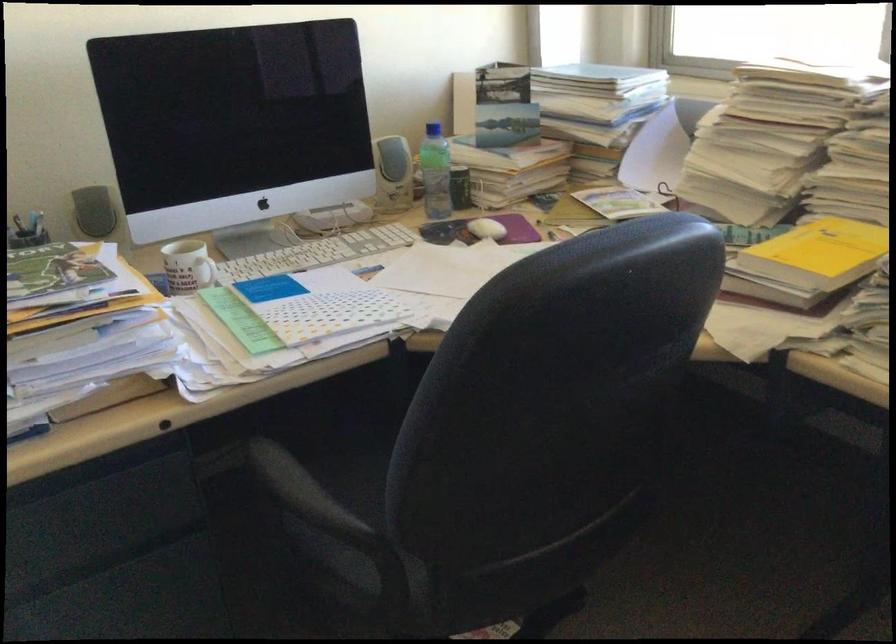
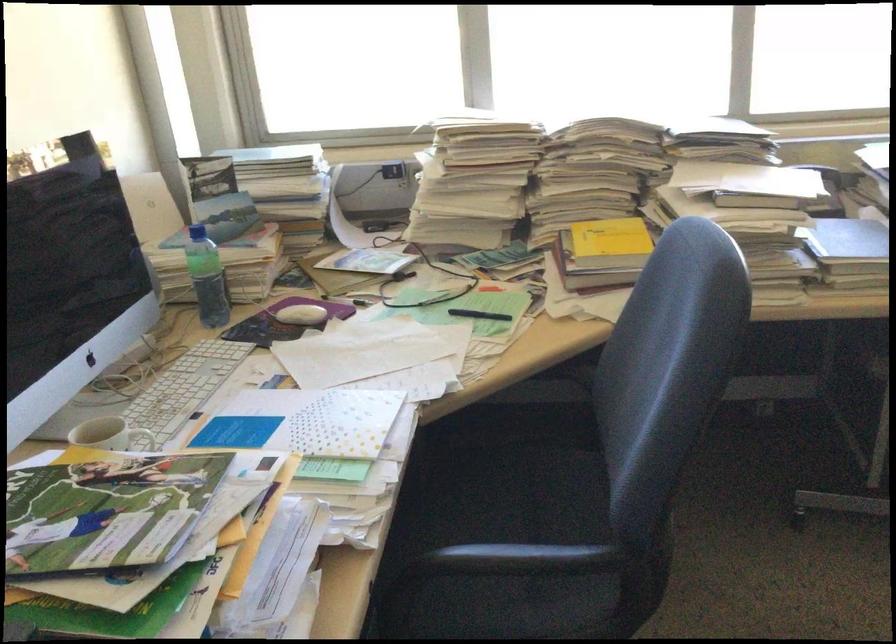
Question: The first image is from the beginning of the video and the second image is from the end. How did the camera likely rotate when shooting the video?

Choices:
 (A) Left
 (B) Right
 (C) Up
 (D) Down

Answer: (B)